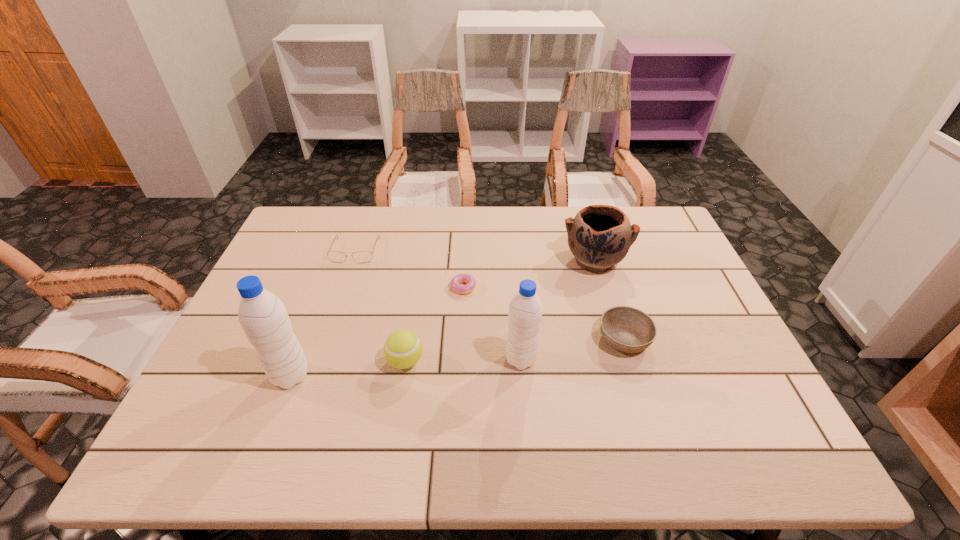
Identify the location of vacant point located between the left water bottle and the third tallest object. Image resolution: width=960 pixels, height=540 pixels. (443, 318).

At what (x,y) coordinates should I click in order to perform the action: click on blank region between the right water bottle and the second shortest object. Please return your answer as a coordinate pair (x, y). Looking at the image, I should click on (438, 305).

The width and height of the screenshot is (960, 540). I want to click on unoccupied area between the bowl and the doughnut, so click(x=543, y=313).

Identify the location of free space that is in between the taller water bottle and the pottery. (443, 318).

You are a GUI agent. You are given a task and a screenshot of the screen. Output one action in this format:
    pyautogui.click(x=<x>, y=<y>)
    Task: Click on the empty space that is in between the sixth tallest object and the bowl
    
    Given the screenshot: What is the action you would take?
    pyautogui.click(x=490, y=295)

Identify the location of free spot between the fourth shortest object and the fifth shortest object. The height and width of the screenshot is (540, 960). click(x=500, y=311).

This screenshot has height=540, width=960. What are the coordinates of `unoccupied area between the fifth shortest object and the fourth shortest object` in the screenshot? It's located at (500, 311).

Find the location of `free spot between the fifth shortest object and the spectacles`. free spot between the fifth shortest object and the spectacles is located at coordinates (475, 255).

Select which object is the third closest to the fourth object from left to right. Please provide its 2D coordinates. Your answer should be formatted as a tuple, i.e. [(x, y)], where the tuple contains the x and y coordinates of a point satisfying the conditions above.

[(361, 256)]

At what (x,y) coordinates should I click in order to perform the action: click on the fifth closest object to the bowl. Please return your answer as a coordinate pair (x, y). The height and width of the screenshot is (540, 960). Looking at the image, I should click on (361, 256).